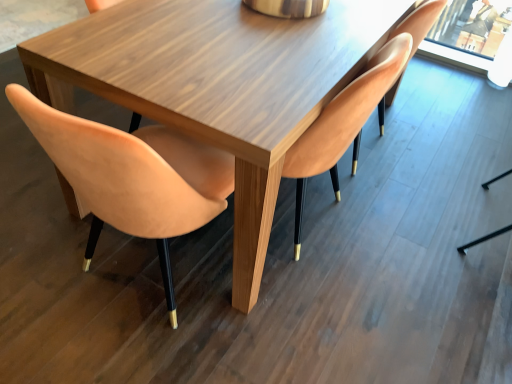
Image resolution: width=512 pixels, height=384 pixels. I want to click on vacant area that is situated to the right of suede-like peach chair at left, which ranks as the third chair in right-to-left order, so click(x=294, y=314).